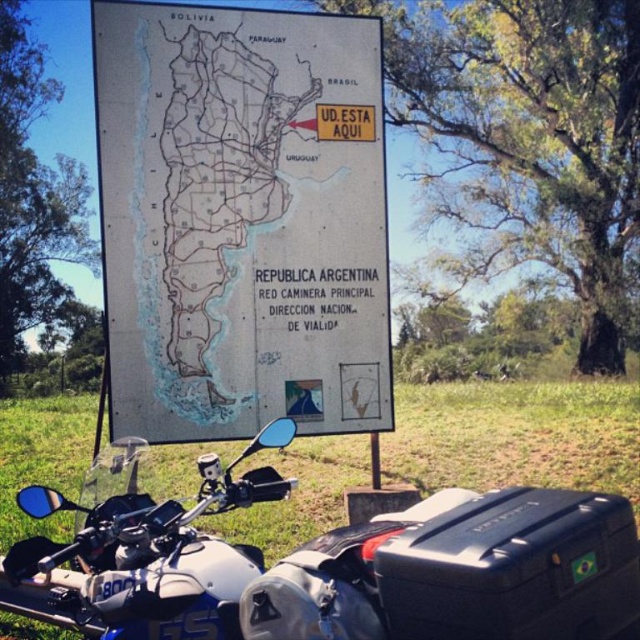
Which is in front, point (138, 365) or point (184, 556)?

Point (184, 556)

Does gray paper map at center appear over silver metallic motorcycle at lower left?

Yes.

Where is `gray paper map at center`? gray paper map at center is located at coordinates (241, 220).